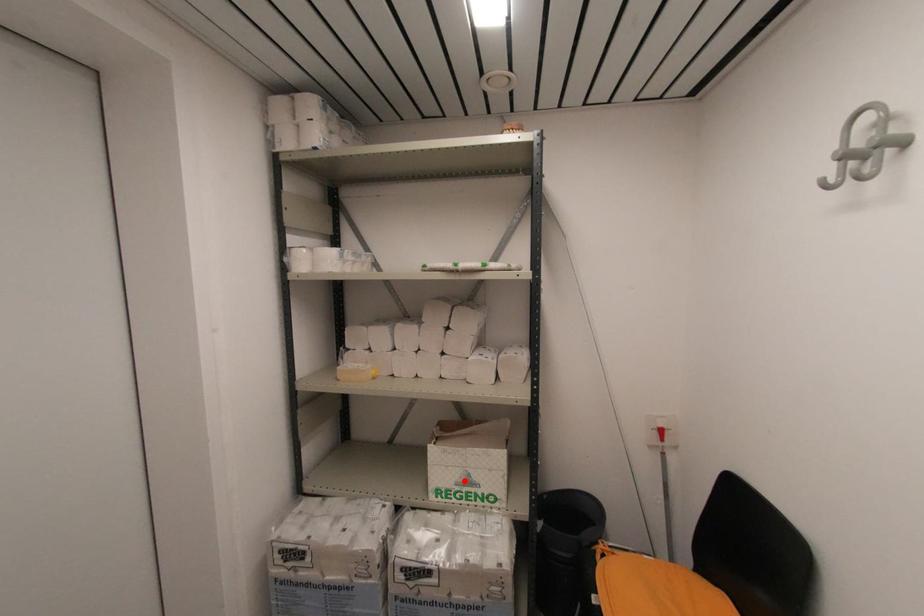
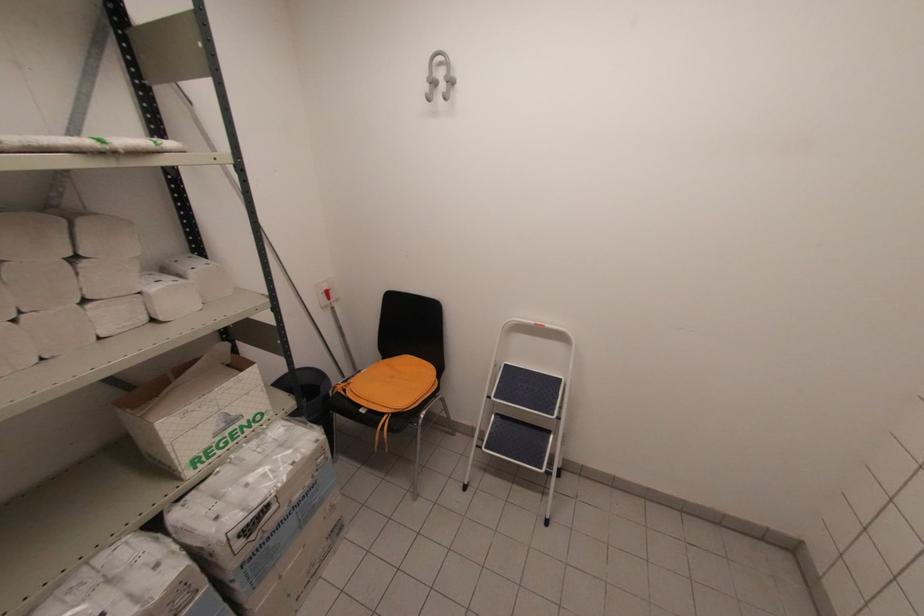
Find the pixel in the second image that matches the highlighted location in the first image.

(224, 426)